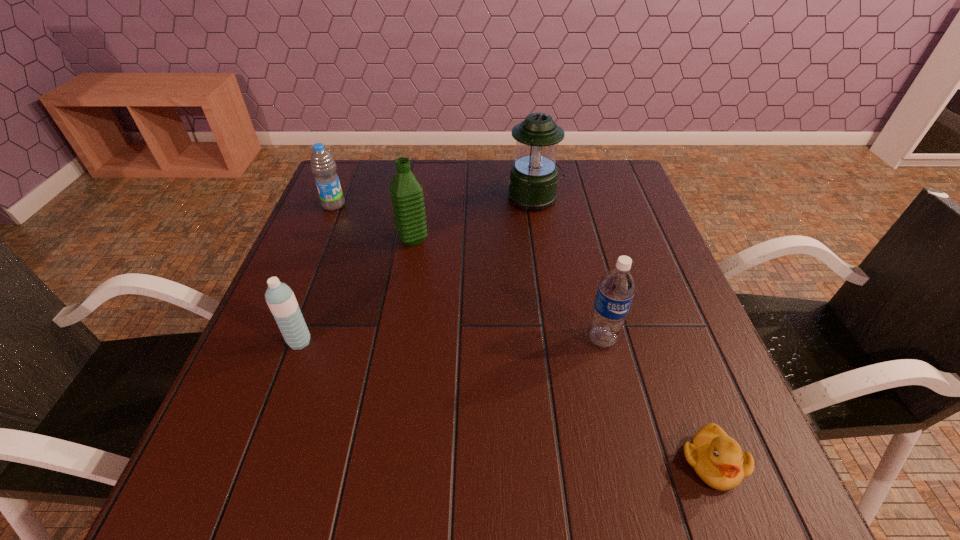
In the image, there is a desktop. At what (x,y) coordinates should I click in order to perform the action: click on free space at the right edge. Please return your answer as a coordinate pair (x, y). This screenshot has width=960, height=540. Looking at the image, I should click on point(677,347).

Locate an element on the screen. vacant space at the far left corner of the desktop is located at coordinates (339, 177).

Where is `vacant region at the far right corner of the desktop`? Image resolution: width=960 pixels, height=540 pixels. vacant region at the far right corner of the desktop is located at coordinates (591, 170).

This screenshot has height=540, width=960. I want to click on free point between the lantern and the farthest water bottle, so click(x=434, y=202).

The width and height of the screenshot is (960, 540). What are the coordinates of `free space between the lantern and the fourth object from right to left` in the screenshot? It's located at (473, 219).

The image size is (960, 540). In order to click on free point between the farthest water bottle and the lantern in this screenshot , I will do point(434,202).

Where is `free point between the lantern and the shortest object`? The height and width of the screenshot is (540, 960). free point between the lantern and the shortest object is located at coordinates (623, 330).

In order to click on vacant area that lies between the lantern and the third farthest object in this screenshot , I will do `click(473, 219)`.

I want to click on empty location between the fourth object from right to left and the rightmost water bottle, so click(507, 289).

I want to click on vacant space that's between the rightmost water bottle and the farthest water bottle, so click(468, 272).